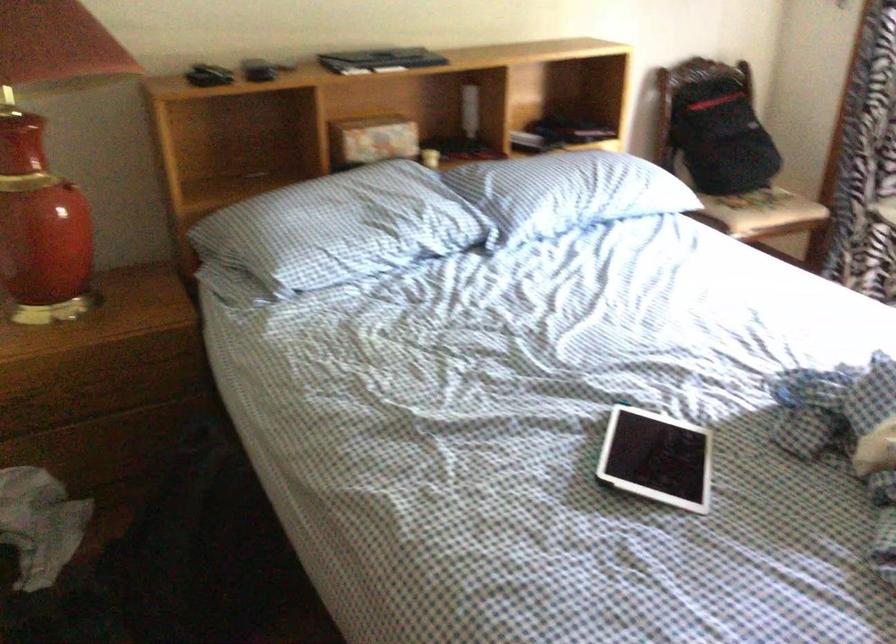
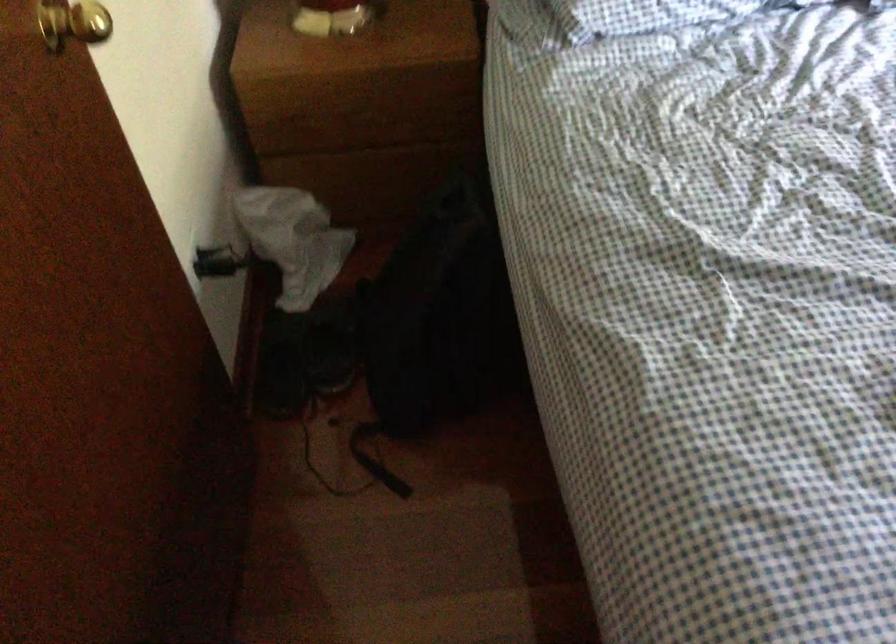
Find the pixel in the second image that matches point 202,545 in the first image.

(441, 317)